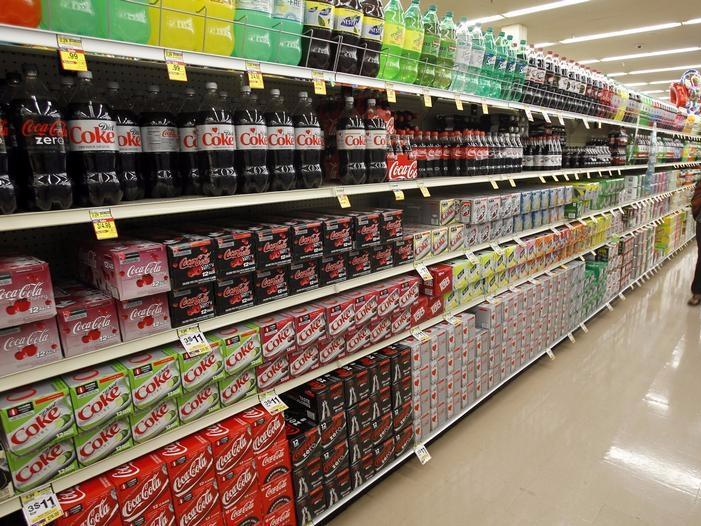
Locate an element on the screen. This screenshot has height=526, width=701. bottles of diet coke is located at coordinates (107, 156), (122, 136), (163, 124), (188, 114), (219, 130), (265, 123), (287, 133), (310, 134), (360, 145), (381, 139).